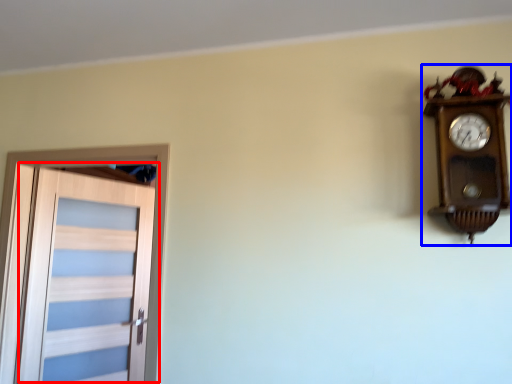
Question: Among these objects, which one is nearest to the camera, door (highlighted by a red box) or wall clock (highlighted by a blue box)?

Choices:
 (A) door
 (B) wall clock

Answer: (B)